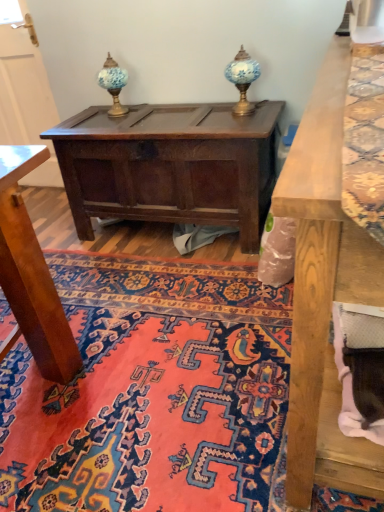
At what (x,y) coordinates should I click in order to perform the action: click on empty space that is ontop of dark brown wood chest at center. Please return your answer as a coordinate pair (x, y). Looking at the image, I should click on (144, 118).